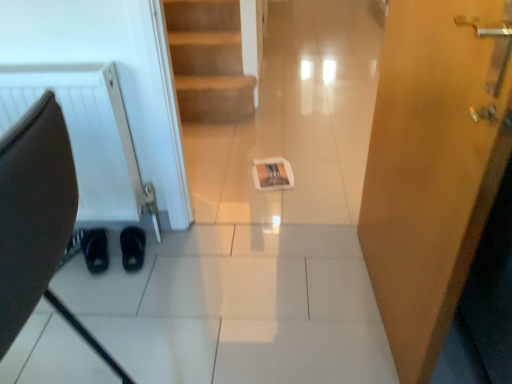
Where is `free space between black suede shoes at lower left, which is the second footwear from left to right, and black suede shoes at lower left, which is the 2th footwear in right-to-left order`? The width and height of the screenshot is (512, 384). free space between black suede shoes at lower left, which is the second footwear from left to right, and black suede shoes at lower left, which is the 2th footwear in right-to-left order is located at coordinates (108, 259).